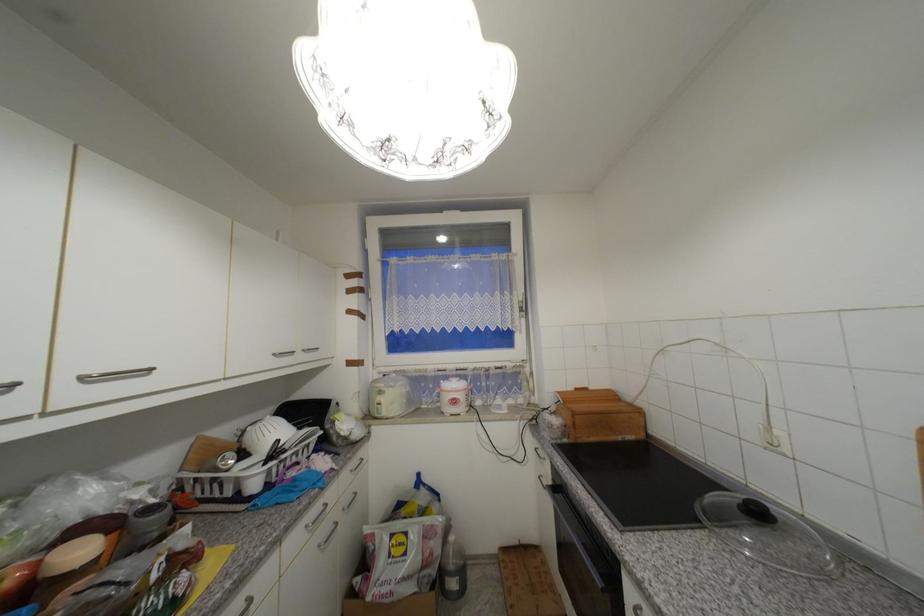
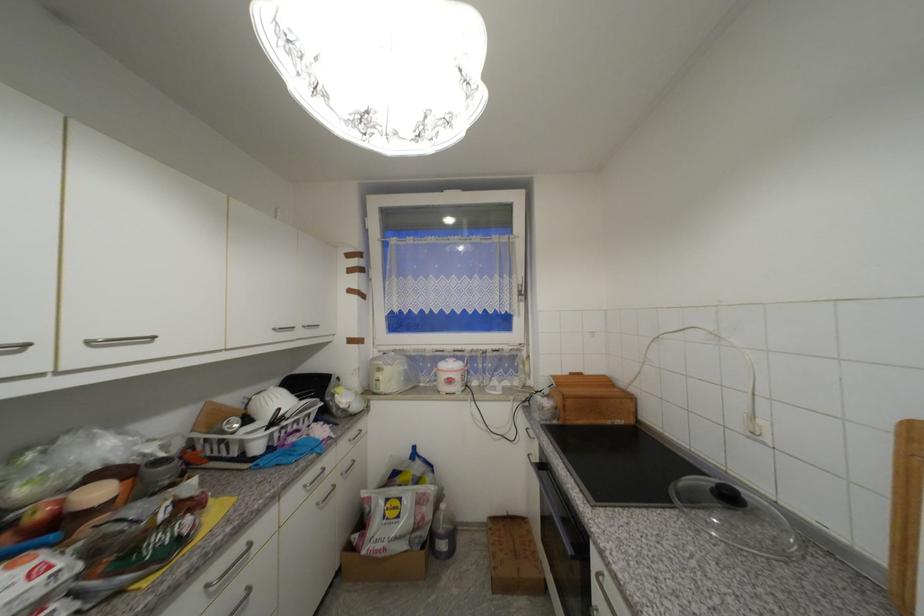
Where in the second image is the point corresponding to the point at 576,390 from the first image?

(572, 374)